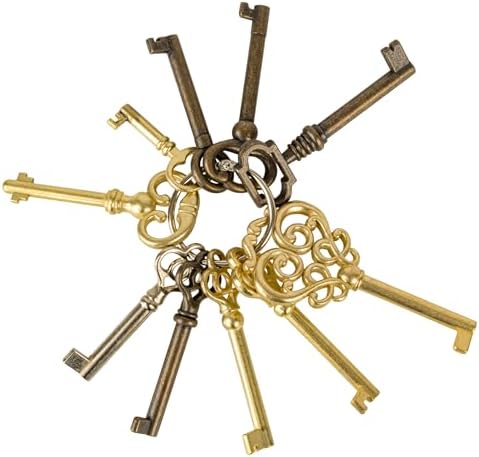
Find the location of a particular element. keys is located at coordinates (103, 195), (153, 134), (195, 110), (252, 91), (338, 125), (392, 288), (332, 345), (251, 374), (171, 370), (114, 328).